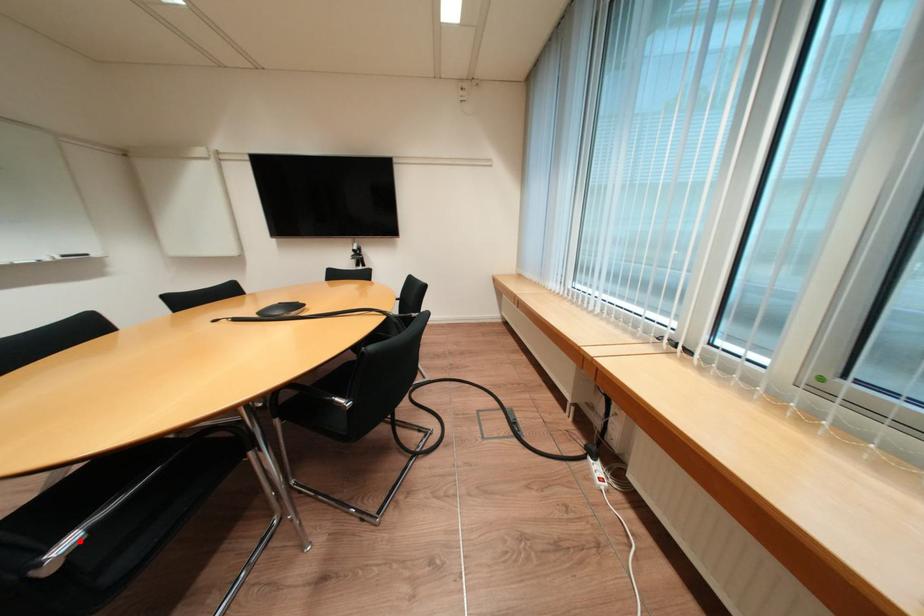
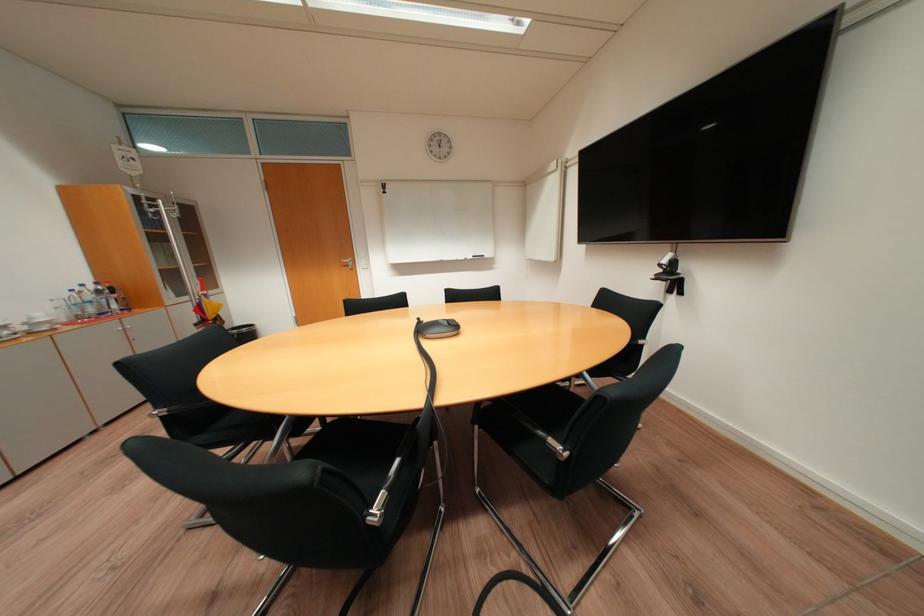
Find the pixel in the second image that matches the highlighted location in the first image.

(176, 411)